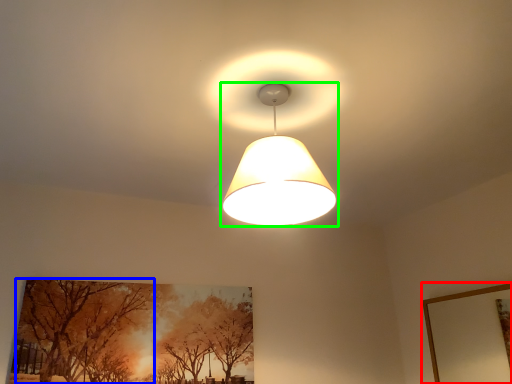
Question: Considering the real-world distances, which object is closest to picture frame (highlighted by a red box)? tree (highlighted by a blue box) or lamp (highlighted by a green box).

Choices:
 (A) tree
 (B) lamp

Answer: (B)